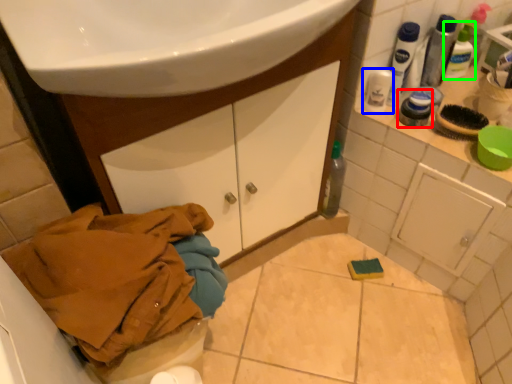
Question: Which is farther away from toiletry (highlighted by a red box)? mouthwash (highlighted by a blue box) or mouthwash (highlighted by a green box)?

Choices:
 (A) mouthwash
 (B) mouthwash

Answer: (B)